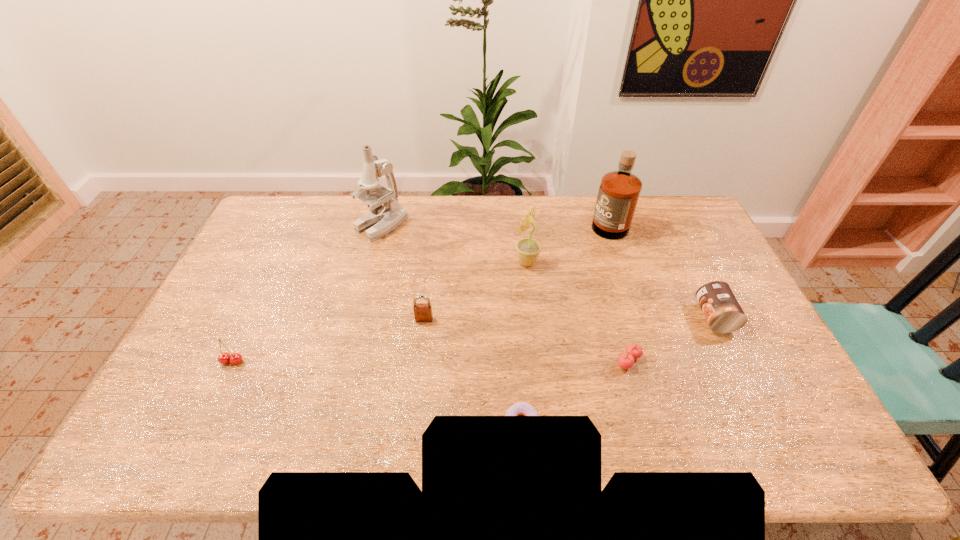
I want to click on microscope, so click(382, 219).

This screenshot has height=540, width=960. Find the location of `liquor`. liquor is located at coordinates (619, 191).

Identify the location of sunflower. Image resolution: width=960 pixels, height=540 pixels. pos(528,249).

Locate an element on the screen. This screenshot has width=960, height=540. the sixth shortest object is located at coordinates (528, 249).

Where is `padlock`? Image resolution: width=960 pixels, height=540 pixels. padlock is located at coordinates (422, 311).

This screenshot has width=960, height=540. What are the coordinates of `can` in the screenshot? It's located at (719, 305).

Locate an element on the screen. the leftmost object is located at coordinates (224, 358).

The height and width of the screenshot is (540, 960). In order to click on the shorter cherry in this screenshot , I will do `click(626, 360)`.

This screenshot has width=960, height=540. What are the coordinates of `the right cherry` in the screenshot? It's located at (626, 360).

Find the location of a particular element. The width and height of the screenshot is (960, 540). the nearest object is located at coordinates (521, 408).